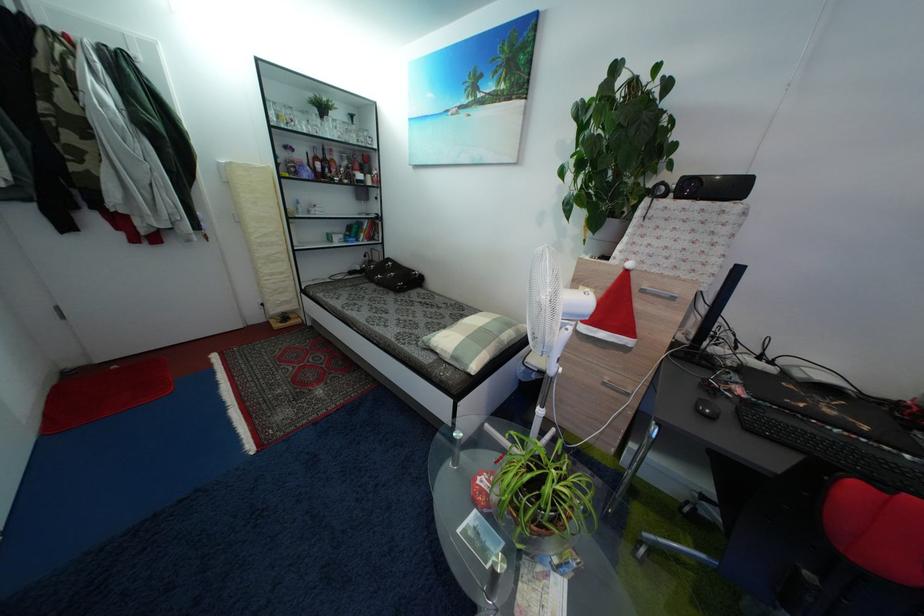
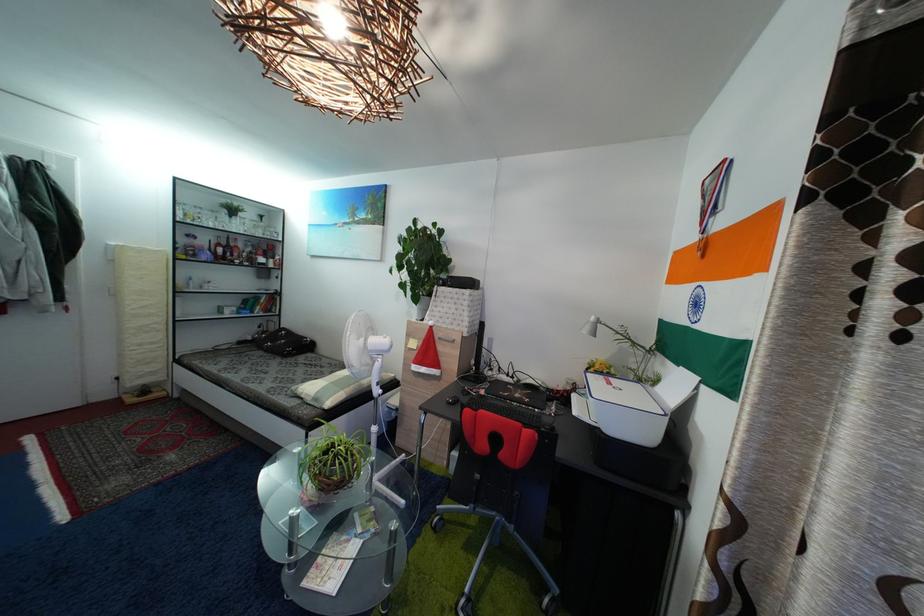
Find the pixel in the second image that matches [329,163] in the first image.

(233, 251)